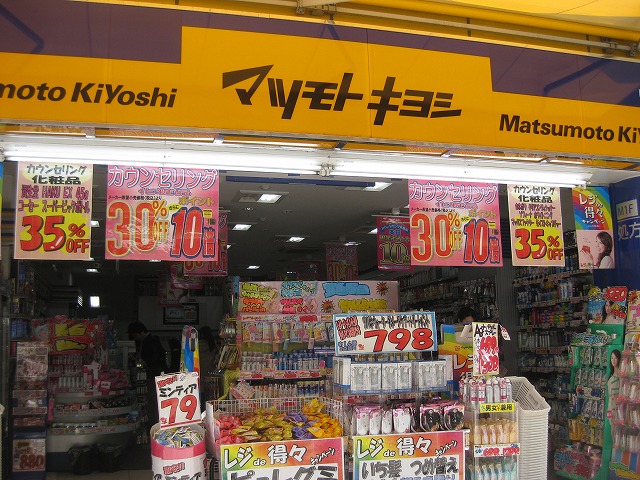
Locate an element on the screen. This screenshot has width=640, height=480. vent is located at coordinates (244, 196), (274, 235), (365, 221).